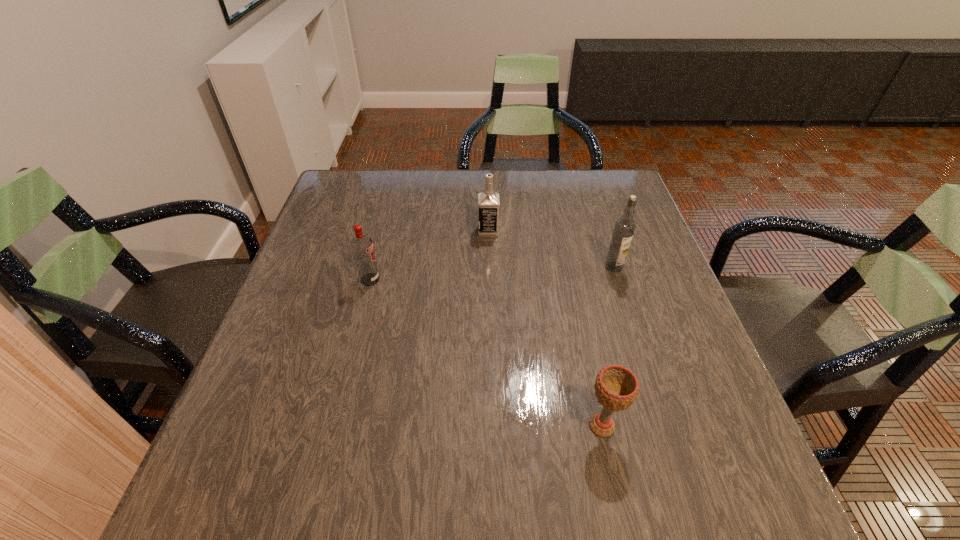
Where is `free location that satisfies the following two spatial constraints: 1. on the front label of the nearest object; 2. on the right side of the leftmost object`? This screenshot has width=960, height=540. free location that satisfies the following two spatial constraints: 1. on the front label of the nearest object; 2. on the right side of the leftmost object is located at coordinates (332, 426).

The image size is (960, 540). I want to click on free spot that satisfies the following two spatial constraints: 1. on the front label of the leftmost object; 2. on the left side of the nearest object, so click(x=332, y=426).

Find the location of a particular element. The width and height of the screenshot is (960, 540). vacant space that satisfies the following two spatial constraints: 1. on the label of the tallest vodka; 2. on the front label of the leftmost vodka is located at coordinates (618, 279).

Find the location of a particular element. The height and width of the screenshot is (540, 960). vacant region that satisfies the following two spatial constraints: 1. on the label of the rightmost object; 2. on the front label of the leftmost object is located at coordinates (618, 279).

Where is `blank space that satisfies the following two spatial constraints: 1. on the front label of the second object from right to left; 2. on the left side of the second object from left to right`? The width and height of the screenshot is (960, 540). blank space that satisfies the following two spatial constraints: 1. on the front label of the second object from right to left; 2. on the left side of the second object from left to right is located at coordinates (492, 426).